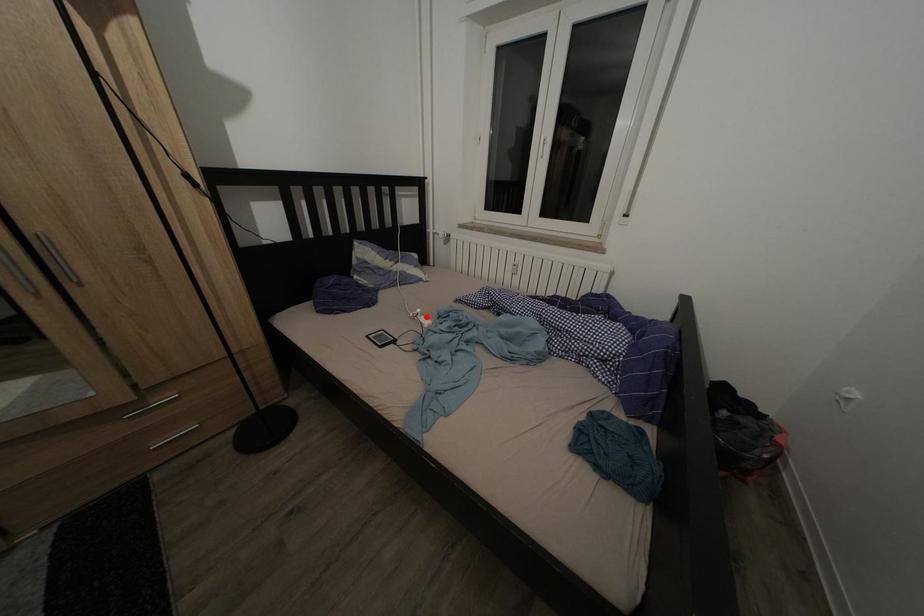
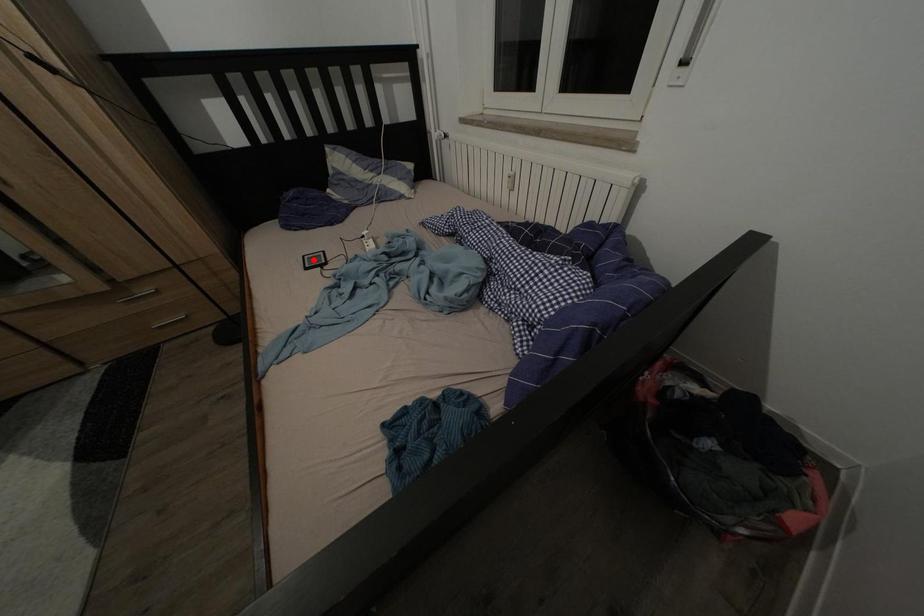
From the picture: I am providing you with two images of the same scene from different viewpoints. A red point is marked on the first image and another point is marked on the second image. Is the marked point in image1 the same physical position as the marked point in image2?

No